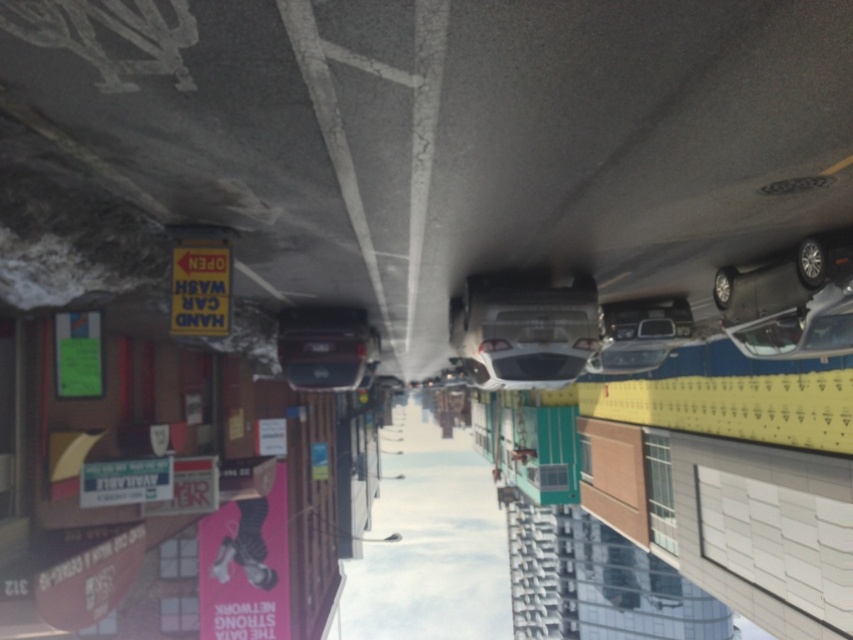
Question: Is white glossy car at center closer to camera compared to shiny silver car at right?

Choices:
 (A) yes
 (B) no

Answer: (B)

Question: Where is shiny silver car at upper right located in relation to shiny silver car at right in the image?

Choices:
 (A) left
 (B) right

Answer: (A)

Question: Which of the following is the farthest from the observer?

Choices:
 (A) (837, 312)
 (B) (503, 374)
 (C) (287, 307)

Answer: (C)

Question: Which object appears farthest from the camera in this image?

Choices:
 (A) shiny silver car at upper right
 (B) white glossy car at center

Answer: (B)

Question: Which of the following is the farthest from the observer?

Choices:
 (A) (556, 365)
 (B) (294, 376)

Answer: (B)

Question: Can you confirm if shiny black car at center is smaller than shiny silver car at upper right?

Choices:
 (A) yes
 (B) no

Answer: (B)